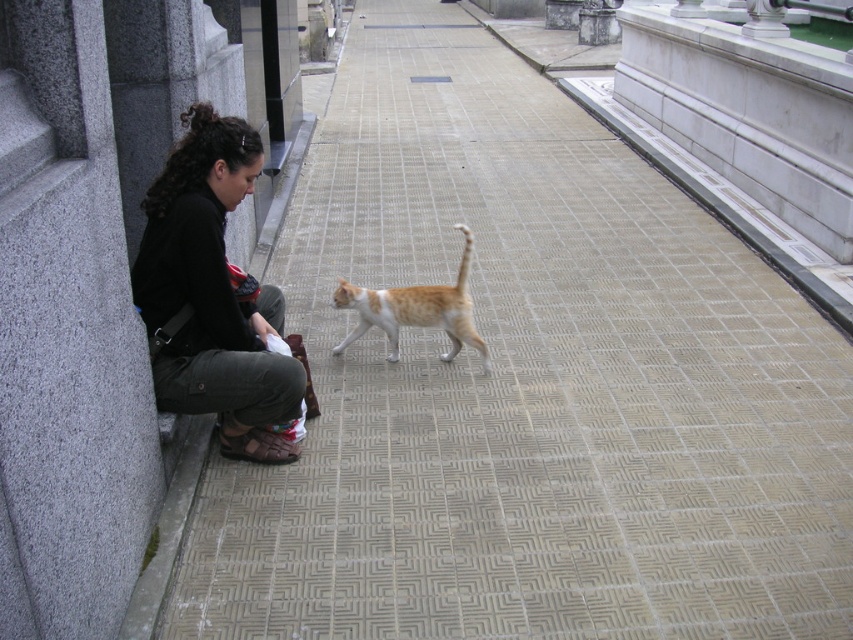
Question: Is dark brown leather jacket at lower left below orange fur cat at center?

Choices:
 (A) yes
 (B) no

Answer: (B)

Question: Which of the following is the farthest from the observer?

Choices:
 (A) orange fur cat at center
 (B) dark brown leather jacket at lower left

Answer: (A)

Question: Is dark brown leather jacket at lower left thinner than orange fur cat at center?

Choices:
 (A) yes
 (B) no

Answer: (A)

Question: Is dark brown leather jacket at lower left bigger than orange fur cat at center?

Choices:
 (A) yes
 (B) no

Answer: (A)